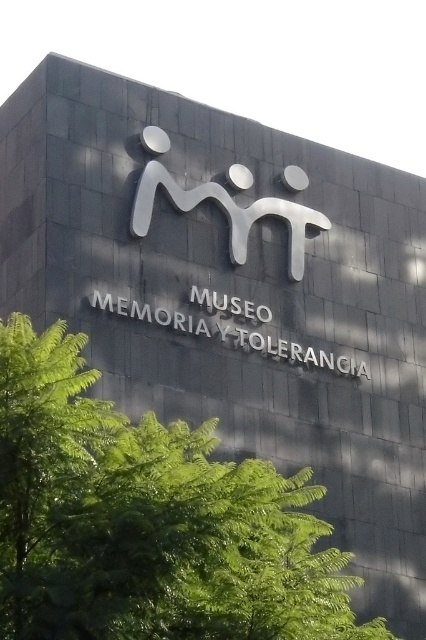
Question: Does green leafy tree at center have a smaller size compared to sleek silver logo at center?

Choices:
 (A) yes
 (B) no

Answer: (B)

Question: Among these points, which one is farthest from the camera?

Choices:
 (A) (8, 577)
 (B) (317, 212)

Answer: (B)

Question: Is the position of green leafy tree at center more distant than that of sleek silver logo at center?

Choices:
 (A) no
 (B) yes

Answer: (A)

Question: Which object appears closest to the camera in this image?

Choices:
 (A) sleek silver logo at center
 (B) green leafy tree at center

Answer: (B)

Question: Is green leafy tree at center smaller than sleek silver logo at center?

Choices:
 (A) no
 (B) yes

Answer: (A)

Question: Which point is closer to the camera taking this photo?

Choices:
 (A) (310, 500)
 (B) (210, 188)

Answer: (A)